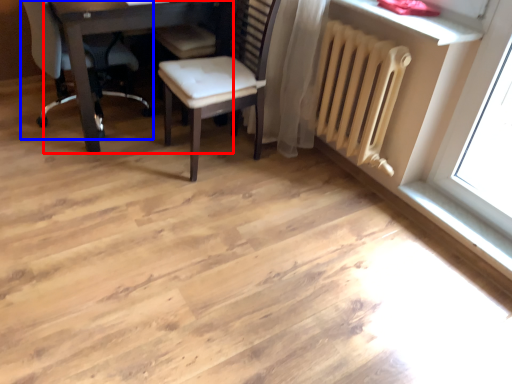
Question: Which object appears farthest to the camera in this image, table (highlighted by a red box) or chair (highlighted by a blue box)?

Choices:
 (A) table
 (B) chair

Answer: (B)